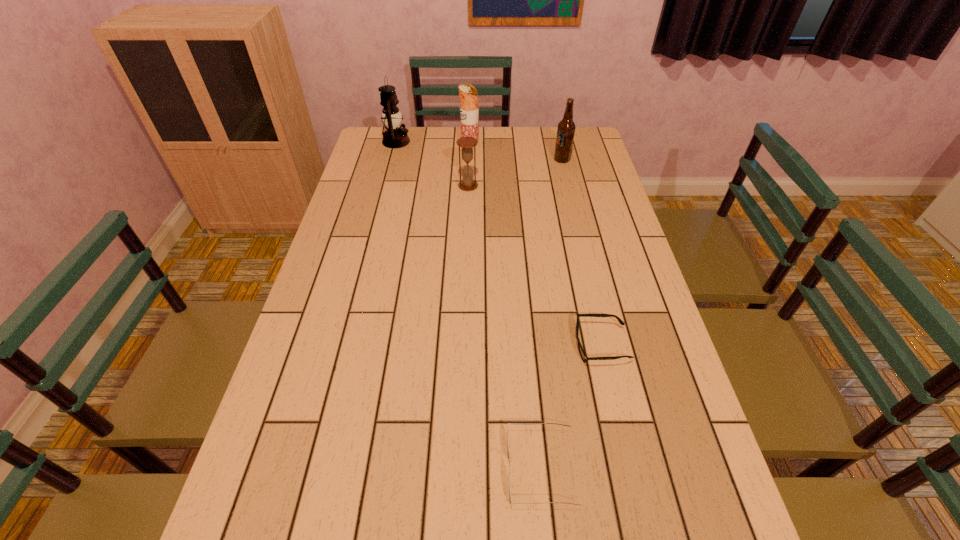
Image resolution: width=960 pixels, height=540 pixels. In order to click on lantern in this screenshot , I will do `click(394, 137)`.

Where is `burrito`? burrito is located at coordinates (469, 111).

Where is `beer bottle`? The width and height of the screenshot is (960, 540). beer bottle is located at coordinates (566, 128).

Identify the location of the fourth farthest object. (467, 183).

Where is `hourglass`? The height and width of the screenshot is (540, 960). hourglass is located at coordinates (467, 183).

Where is `the right sunglasses`? This screenshot has height=540, width=960. the right sunglasses is located at coordinates (584, 357).

Locate an element on the screen. The height and width of the screenshot is (540, 960). the fifth farthest object is located at coordinates (584, 357).

The image size is (960, 540). Identify the location of the fourth object from left to right. (508, 455).

Where is `the nearest object`? This screenshot has width=960, height=540. the nearest object is located at coordinates (508, 455).

Locate an element on the screen. The image size is (960, 540). vacant space situated on the side of the leftmost object, there is a wick adjustment knob is located at coordinates (438, 141).